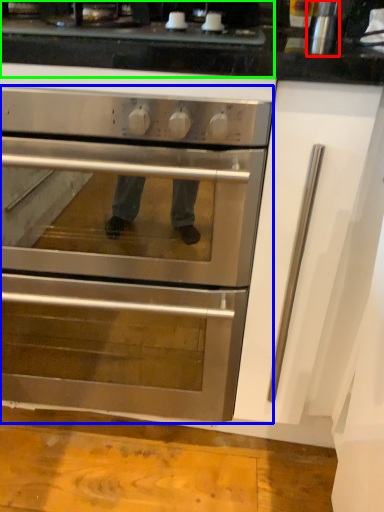
Question: Considering the real-world distances, which object is farthest from appliance (highlighted by a red box)? oven (highlighted by a blue box) or gas stove (highlighted by a green box)?

Choices:
 (A) oven
 (B) gas stove

Answer: (A)